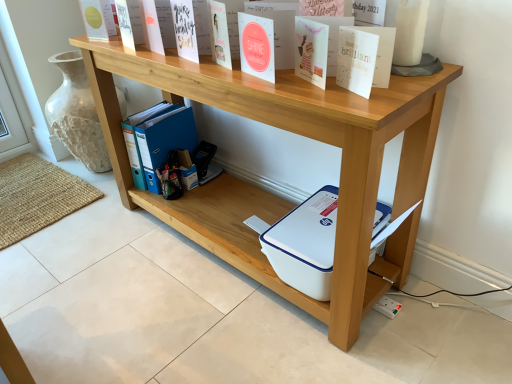
I want to click on free location to the right of white paper at upper right, which appears as the third paperback book when viewed from the top, so click(x=406, y=84).